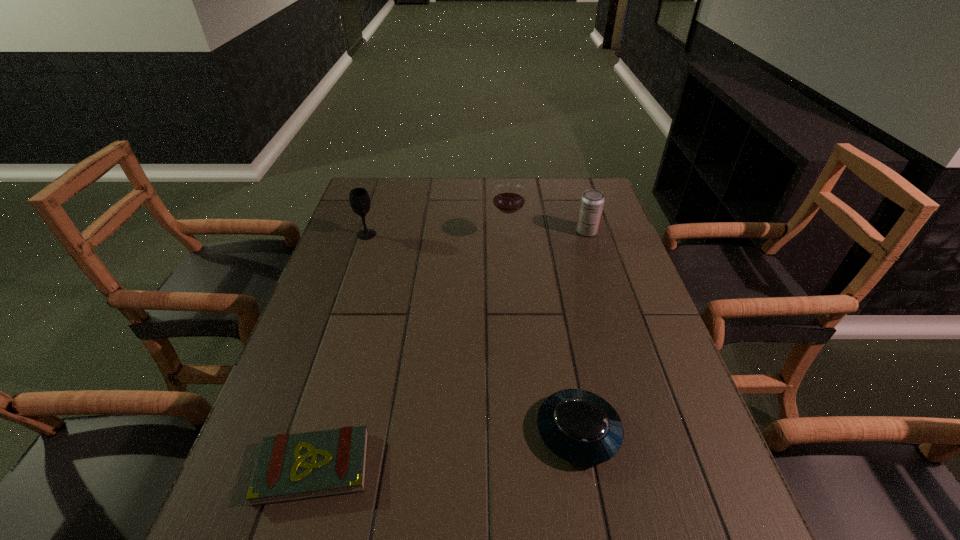
Locate an element on the screen. wineglass at the left edge is located at coordinates (359, 199).

The width and height of the screenshot is (960, 540). I want to click on book that is at the left edge, so click(x=289, y=467).

Identify the location of object located at the right edge. The height and width of the screenshot is (540, 960). (592, 201).

This screenshot has height=540, width=960. In order to click on vacant space at the far edge of the desktop in this screenshot , I will do `click(553, 191)`.

In the image, there is a desktop. At what (x,y) coordinates should I click in order to perform the action: click on vacant space at the left edge. Please return your answer as a coordinate pair (x, y). This screenshot has height=540, width=960. Looking at the image, I should click on (339, 350).

You are a GUI agent. You are given a task and a screenshot of the screen. Output one action in this format:
    pyautogui.click(x=<x>, y=<y>)
    Task: Click on the vacant region at the right edge of the desktop
    
    Given the screenshot: What is the action you would take?
    pyautogui.click(x=602, y=302)

Where is `free location at the far left corner`? The height and width of the screenshot is (540, 960). free location at the far left corner is located at coordinates (380, 189).

In the image, there is a desktop. Identify the location of free region at the far right corner. The image size is (960, 540). (563, 198).

This screenshot has height=540, width=960. Identify the location of unoccupied area between the saucer and the left wineglass. (472, 333).

In order to click on unoccupied position between the right wineglass and the soda in this screenshot , I will do `click(547, 234)`.